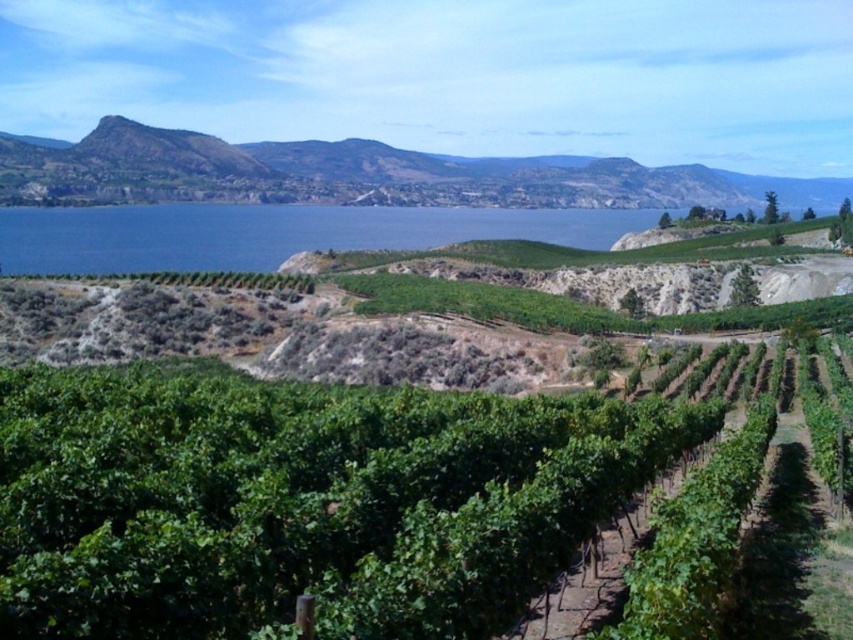
You are standing in the vineyard and want to walk towards the green leafy hillside at upper center. Which direction should you move relative to the green leafy vines at center?

The green leafy vines at center are to the right of the green leafy hillside at upper center, so you should move to the left to reach the green leafy hillside at upper center.

You are a landscape architect planning to install a new irrigation system. You need to determine which area requires more water based on the size of the vegetation. Which of the two areas, the green leafy vines at center or the green leafy hillside at upper center, would need more water?

The green leafy hillside at upper center would need more water since it occupies more space than the green leafy vines at center.

You are a landscape architect planning to install a new irrigation system. You need to determine the position of the green leafy hillside at upper center relative to the main vineyard rows. Based on the coordinates provided, can you confirm if the hillside is positioned to the left or right of the central axis of the vineyard rows?

The green leafy hillside at upper center is located at point coordinates that place it to the left of the central axis of the vineyard rows, as the x coordinate of 0.273 is less than 0.5, indicating a position to the left in the image coordinate system.